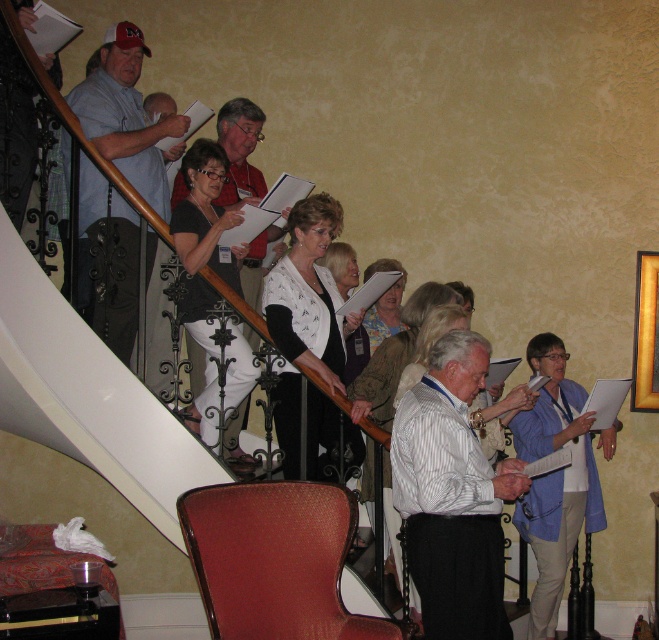
Question: Estimate the real-world distances between objects in this image. Which object is closer to the matte black blazer at center?

Choices:
 (A) red textured fabric chair at lower center
 (B) blue fabric shirt at lower right
 (C) matte white blouse at center

Answer: (C)

Question: Estimate the real-world distances between objects in this image. Which object is farther from the light blue shirt at upper left?

Choices:
 (A) white textured sweater at center
 (B) matte white blouse at center

Answer: (B)

Question: Can you confirm if white textured sweater at center is thinner than matte white blouse at center?

Choices:
 (A) no
 (B) yes

Answer: (A)

Question: Is white textured vest at center smaller than matte black shirt at upper center?

Choices:
 (A) yes
 (B) no

Answer: (A)

Question: Based on their relative distances, which object is farther from the blue fabric shirt at lower right?

Choices:
 (A) white textured sweater at center
 (B) red textured fabric chair at lower center
 (C) matte black blazer at center
 (D) matte white blouse at center

Answer: (B)

Question: Does red textured fabric chair at lower center come in front of white textured sweater at center?

Choices:
 (A) no
 (B) yes

Answer: (B)